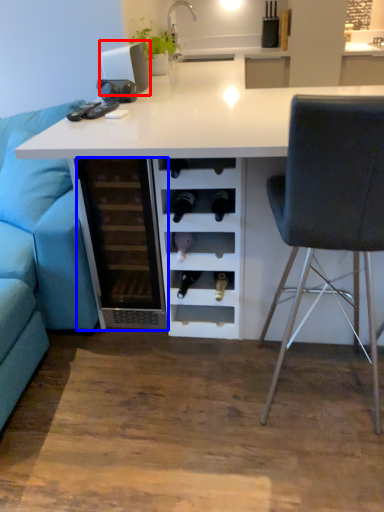
Question: Among these objects, which one is nearest to the camera, appliance (highlighted by a red box) or file cabinet (highlighted by a blue box)?

Choices:
 (A) appliance
 (B) file cabinet

Answer: (B)